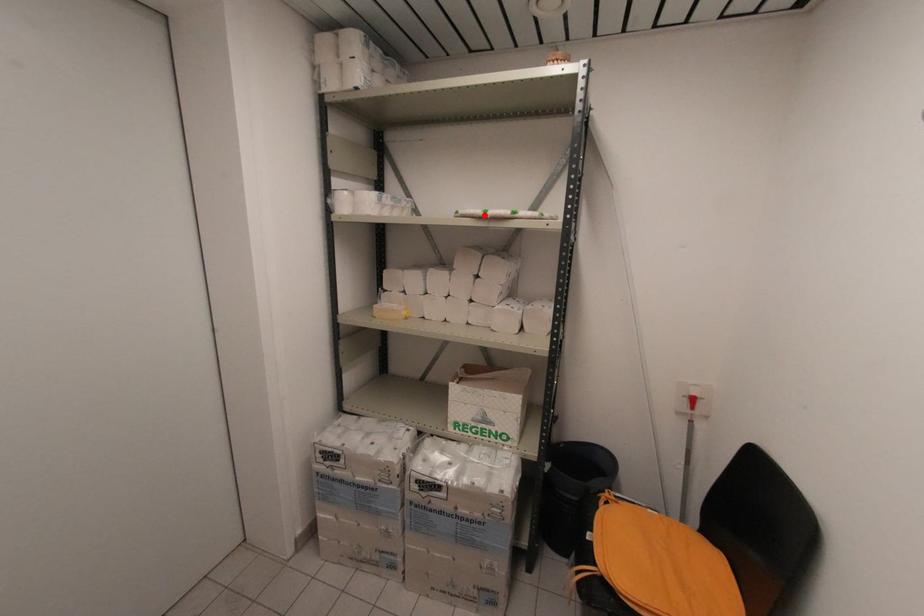
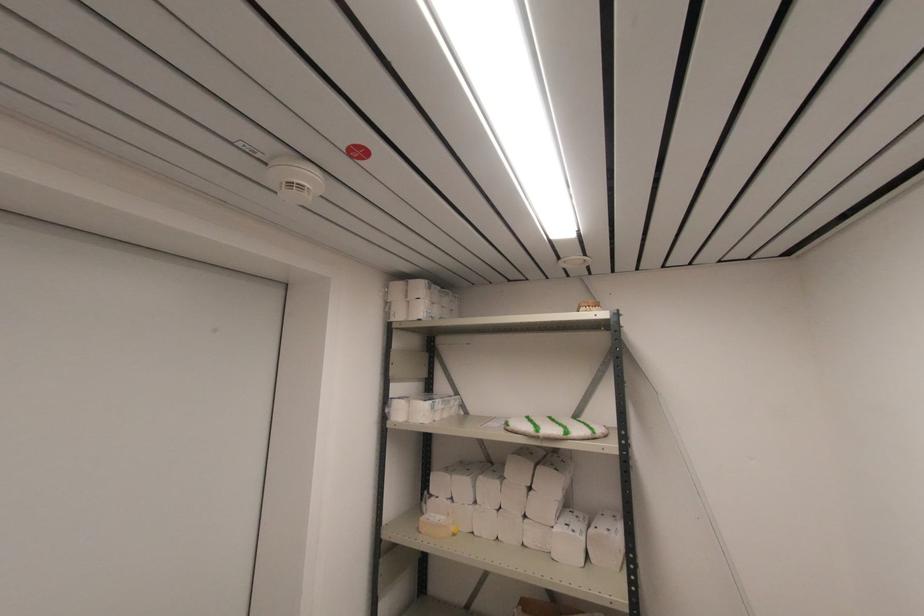
Question: I am providing you with two images of the same scene from different viewpoints. Given a red point in image1, look at the same physical point in image2. Is it:

Choices:
 (A) Closer to the viewpoint
 (B) Farther from the viewpoint

Answer: (B)